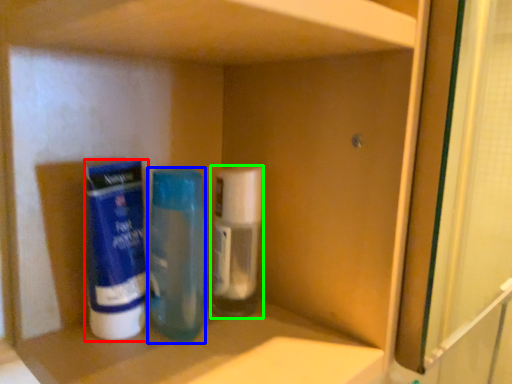
Question: Considering the real-world distances, which object is farthest from cleaning product (highlighted by a red box)? bottle (highlighted by a blue box) or bottle (highlighted by a green box)?

Choices:
 (A) bottle
 (B) bottle

Answer: (B)